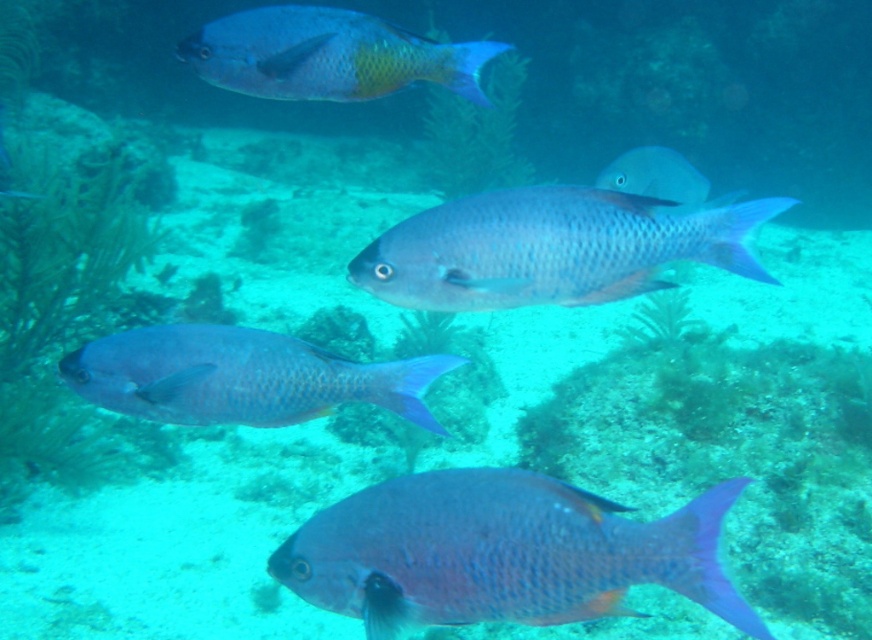
You are a marine biologist observing the underwater scene. You notice two fish, the matte blue fish at center and the shiny blue fish at upper center. Which fish is positioned higher in the water column?

The shiny blue fish at upper center is positioned higher in the water column since it is located above the matte blue fish at center.